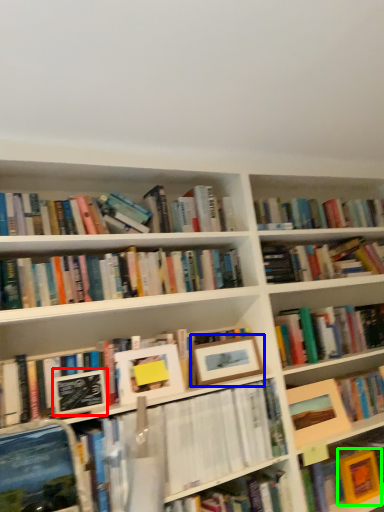
Question: Based on their relative distances, which object is nearer to paperback book (highlighted by a red box)? Choose from picture frame (highlighted by a blue box) and paperback book (highlighted by a green box).

Choices:
 (A) picture frame
 (B) paperback book

Answer: (A)